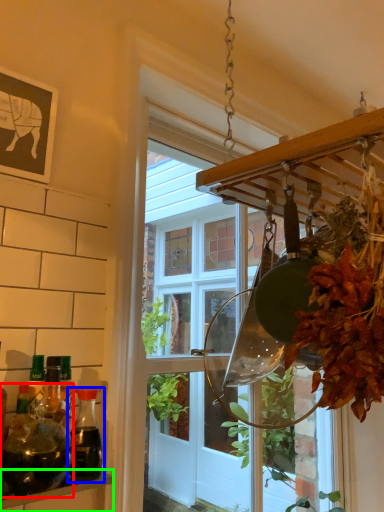
Question: Which object is positioned farthest from bottle (highlighted by a red box)? Select from bottle (highlighted by a blue box) and shelf (highlighted by a green box).

Choices:
 (A) bottle
 (B) shelf

Answer: (B)